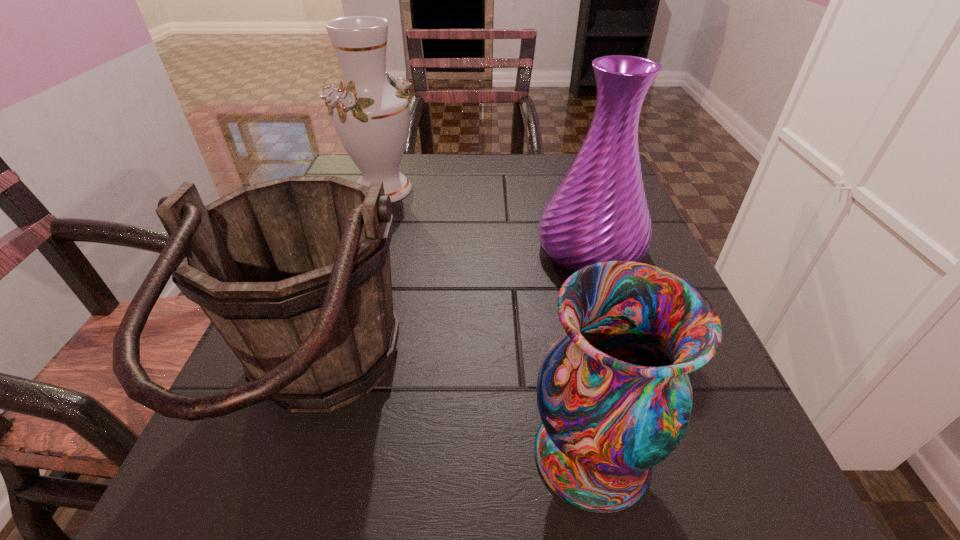
Select which object is the third closest to the second farthest vase. Please provide its 2D coordinates. Your answer should be formatted as a tuple, i.e. [(x, y)], where the tuple contains the x and y coordinates of a point satisfying the conditions above.

[(371, 116)]

The width and height of the screenshot is (960, 540). In order to click on object that stands as the closest to the shortest vase in this screenshot , I will do `click(294, 273)`.

Where is `vase identified as the closest to the second farthest object`? vase identified as the closest to the second farthest object is located at coordinates (613, 394).

Identify which vase is located as the nearest to the second farthest vase. Please provide its 2D coordinates. Your answer should be formatted as a tuple, i.e. [(x, y)], where the tuple contains the x and y coordinates of a point satisfying the conditions above.

[(613, 394)]

This screenshot has width=960, height=540. In order to click on free spot that satisfies the following two spatial constraints: 1. on the handle side of the bucket; 2. on the back side of the shortest vase in this screenshot , I will do `click(296, 455)`.

Identify the location of vacant region that satisfies the following two spatial constraints: 1. on the back side of the nearest vase; 2. on the handle side of the bucket. This screenshot has width=960, height=540. (579, 390).

Find the location of a particular element. This screenshot has height=540, width=960. vacant region that satisfies the following two spatial constraints: 1. on the front side of the farthest object; 2. on the right side of the shortest vase is located at coordinates [296, 455].

Locate an element on the screen. vacant region that satisfies the following two spatial constraints: 1. on the back side of the shortest vase; 2. on the handle side of the bucket is located at coordinates (579, 390).

The height and width of the screenshot is (540, 960). What are the coordinates of `vacant space that satisfies the following two spatial constraints: 1. on the front side of the farthest object; 2. on the left side of the second nearest vase` in the screenshot? It's located at (363, 249).